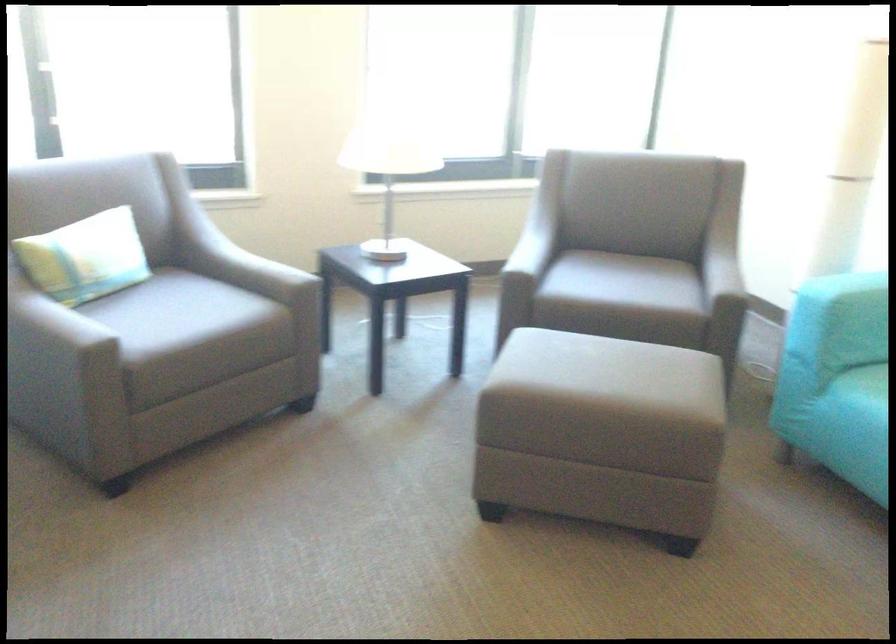
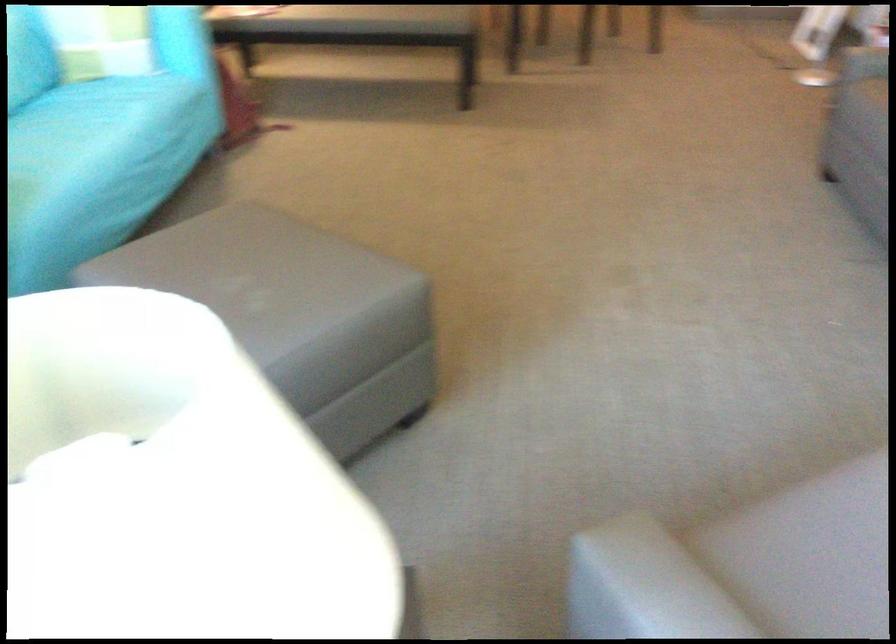
In the second image, find the point that corresponds to [254,272] in the first image.

(665, 583)